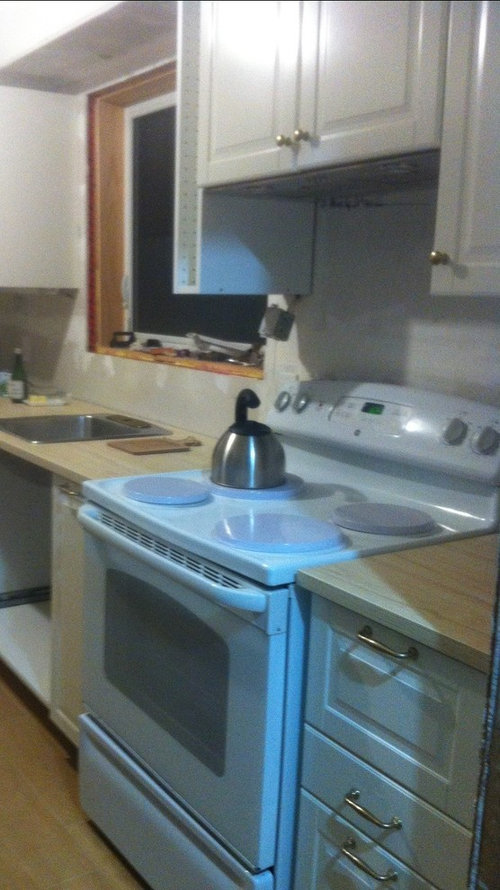
Locate an element on the screen. The height and width of the screenshot is (890, 500). bottle is located at coordinates (16, 369).